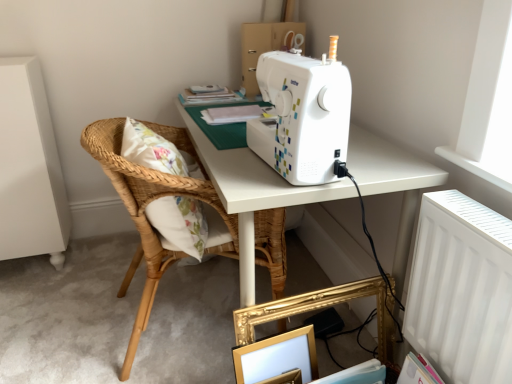
What do you see at coordinates (303, 115) in the screenshot? The image size is (512, 384). I see `white plastic sewing machine at upper center` at bounding box center [303, 115].

Locate an element on the screen. white plastic sewing machine at upper center is located at coordinates (303, 115).

What do you see at coordinates (231, 114) in the screenshot?
I see `white paper at upper center` at bounding box center [231, 114].

Describe the element at coordinates (461, 289) in the screenshot. I see `white plastic radiator at upper right` at that location.

The height and width of the screenshot is (384, 512). In order to click on white plastic radiator at upper right in this screenshot , I will do `click(461, 289)`.

This screenshot has height=384, width=512. Identify the location of gold metallic picture frame at lower center. (277, 357).

At what (x,y) coordinates should I click in order to perform the action: click on matte cardboard box at upper center. Please return your answer as a coordinate pair (x, y). The height and width of the screenshot is (384, 512). Looking at the image, I should click on (266, 46).

You are a GUI agent. You are given a task and a screenshot of the screen. Output one action in this format:
    pyautogui.click(x=<x>, y=<y>)
    Task: Click on the white plastic sewing machine at upper center
    The width and height of the screenshot is (512, 384).
    Given the screenshot: What is the action you would take?
    pyautogui.click(x=253, y=194)

The height and width of the screenshot is (384, 512). Identify the location of white plastic sewing machine at upper center. (303, 115).

From the image's perspective, is woven wood chair at left over gold metallic picture frame at lower center?

Yes, from the image's perspective, woven wood chair at left is above gold metallic picture frame at lower center.

From the picture: Which is more to the right, woven wood chair at left or gold metallic picture frame at lower center?

Positioned to the right is gold metallic picture frame at lower center.

Is woven wood chair at left positioned before gold metallic picture frame at lower center?

No, the depth of woven wood chair at left is greater than that of gold metallic picture frame at lower center.

At what (x,y) coordinates should I click in order to perform the action: click on picture frame below the woven wood chair at left (from a real-world perspective). Please return your answer as a coordinate pair (x, y). The width and height of the screenshot is (512, 384). Looking at the image, I should click on (277, 357).

Is natural woven wood pillow at left placed right next to white plastic radiator at upper right?

natural woven wood pillow at left and white plastic radiator at upper right are not in contact.

Is natural woven wood pillow at left turned away from white plastic radiator at upper right?

That's not correct — natural woven wood pillow at left is not looking away from white plastic radiator at upper right.

How different are the orientations of natural woven wood pillow at left and white plastic radiator at upper right in degrees?

176 degrees.

Is natural woven wood pillow at left positioned behind white plastic radiator at upper right?

Yes, natural woven wood pillow at left is behind white plastic radiator at upper right.

Is gold metallic picture frame at lower center in contact with white plastic sewing machine at upper center?

gold metallic picture frame at lower center is not next to white plastic sewing machine at upper center, and they're not touching.

Can you confirm if gold metallic picture frame at lower center is taller than white plastic sewing machine at upper center?

In fact, gold metallic picture frame at lower center may be shorter than white plastic sewing machine at upper center.

Can we say gold metallic picture frame at lower center lies outside white plastic sewing machine at upper center?

Yes.

From the image's perspective, does gold metallic picture frame at lower center appear higher than white plastic sewing machine at upper center?

No, from the image's perspective, gold metallic picture frame at lower center is not above white plastic sewing machine at upper center.

Is white plastic sewing machine at upper center to the left of natural woven wood pillow at left from the viewer's perspective?

No, white plastic sewing machine at upper center is not to the left of natural woven wood pillow at left.

From a real-world perspective, which object stands above the other?

natural woven wood pillow at left, from a real-world perspective.

Is white plastic sewing machine at upper center thinner than natural woven wood pillow at left?

No.

Is white plastic sewing machine at upper center not near natural woven wood pillow at left?

No.

Who is smaller, woven wood chair at left or white plastic sewing machine at upper center?

Smaller between the two is woven wood chair at left.

Between woven wood chair at left and white plastic sewing machine at upper center, which one is positioned behind?

woven wood chair at left is further from the camera.

How much distance is there between woven wood chair at left and white plastic sewing machine at upper center?

11.50 inches.

From a real-world perspective, which object rests below the other?

white plastic sewing machine at upper center is physically lower.

Which is nearer, (x=248, y=365) or (x=327, y=192)?

Point (x=248, y=365).

Is gold metallic picture frame at lower center far away from white plastic sewing machine at upper center?

No, there isn't a large distance between gold metallic picture frame at lower center and white plastic sewing machine at upper center.

From the image's perspective, which object appears higher, gold metallic picture frame at lower center or white plastic sewing machine at upper center?

white plastic sewing machine at upper center is shown above in the image.

From a real-world perspective, which object rests below the other?

gold metallic picture frame at lower center.

From a real-world perspective, which is physically below, white plastic radiator at upper right or white plastic sewing machine at upper center?

In real-world perspective, white plastic radiator at upper right is lower.

Based on the photo, is white plastic radiator at upper right wider than white plastic sewing machine at upper center?

Incorrect, the width of white plastic radiator at upper right does not surpass that of white plastic sewing machine at upper center.

Based on the photo, is white plastic radiator at upper right to the left of white plastic sewing machine at upper center from the viewer's perspective?

Incorrect, white plastic radiator at upper right is not on the left side of white plastic sewing machine at upper center.

Can white plastic sewing machine at upper center be found inside white plastic radiator at upper right?

No.

The image size is (512, 384). What are the coordinates of `chair lying on the left of gold metallic picture frame at lower center` in the screenshot? It's located at (151, 201).

The width and height of the screenshot is (512, 384). I want to click on pillow above the white plastic radiator at upper right (from a real-world perspective), so click(180, 223).

From the image, which object appears to be farther from white plastic sewing machine at upper center, matte cardboard box at upper center or natural woven wood pillow at left?

matte cardboard box at upper center lies further to white plastic sewing machine at upper center than the other object.

From the image, which object appears to be nearer to white paper at upper center, white plastic radiator at upper right or woven wood chair at left?

Among the two, woven wood chair at left is located nearer to white paper at upper center.

Which object lies further to the anchor point white paper at upper center, white plastic sewing machine at upper center or natural woven wood pillow at left?

white plastic sewing machine at upper center is positioned further to the anchor white paper at upper center.

Looking at the image, which one is located closer to natural woven wood pillow at left, white plastic sewing machine at upper center or white paper at upper center?

Among the two, white plastic sewing machine at upper center is located nearer to natural woven wood pillow at left.

When comparing their distances from white paper at upper center, does white plastic sewing machine at upper center or white plastic sewing machine at upper center seem closer?

Among the two, white plastic sewing machine at upper center is located nearer to white paper at upper center.

Which object lies further to the anchor point matte cardboard box at upper center, white plastic sewing machine at upper center or gold metallic picture frame at lower center?

gold metallic picture frame at lower center is further to matte cardboard box at upper center.

Estimate the real-world distances between objects in this image. Which object is further from natural woven wood pillow at left, white paper at upper center or woven wood chair at left?

The object further to natural woven wood pillow at left is white paper at upper center.

Estimate the real-world distances between objects in this image. Which object is further from gold metallic picture frame at lower center, natural woven wood pillow at left or white plastic sewing machine at upper center?

white plastic sewing machine at upper center is positioned further to the anchor gold metallic picture frame at lower center.

You are a GUI agent. You are given a task and a screenshot of the screen. Output one action in this format:
    pyautogui.click(x=<x>, y=<y>)
    Task: Click on the table positioned between white plastic radiator at upper right and matte cardboard box at upper center from near to far
    
    Given the screenshot: What is the action you would take?
    pyautogui.click(x=253, y=194)

Identify the location of picture frame between natural woven wood pillow at left and white plastic radiator at upper right in the horizontal direction. (277, 357).

This screenshot has width=512, height=384. I want to click on chair between matte cardboard box at upper center and gold metallic picture frame at lower center in the up-down direction, so click(x=151, y=201).

The image size is (512, 384). Find the location of `table that lies between white plastic sewing machine at upper center and white plastic radiator at upper right from top to bottom`. table that lies between white plastic sewing machine at upper center and white plastic radiator at upper right from top to bottom is located at coordinates (253, 194).